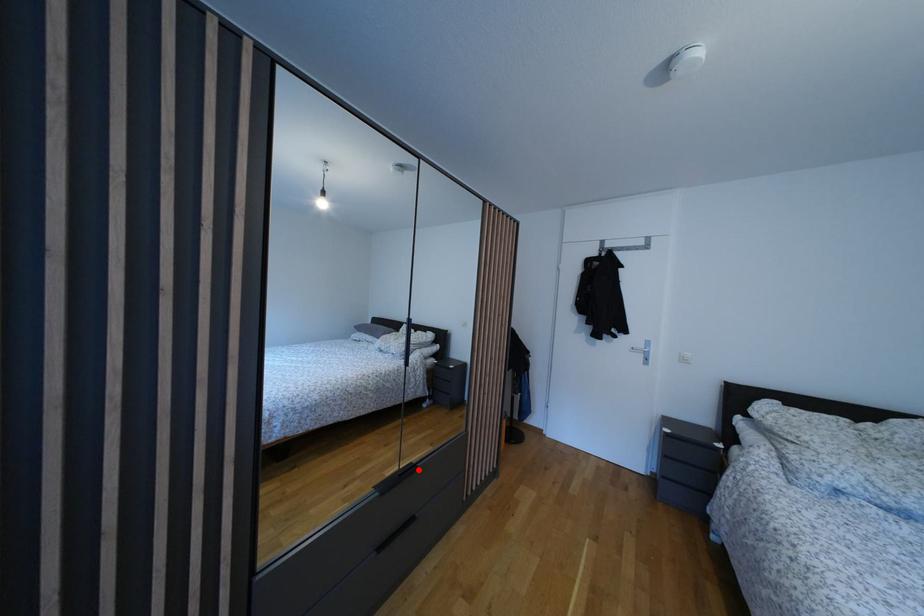
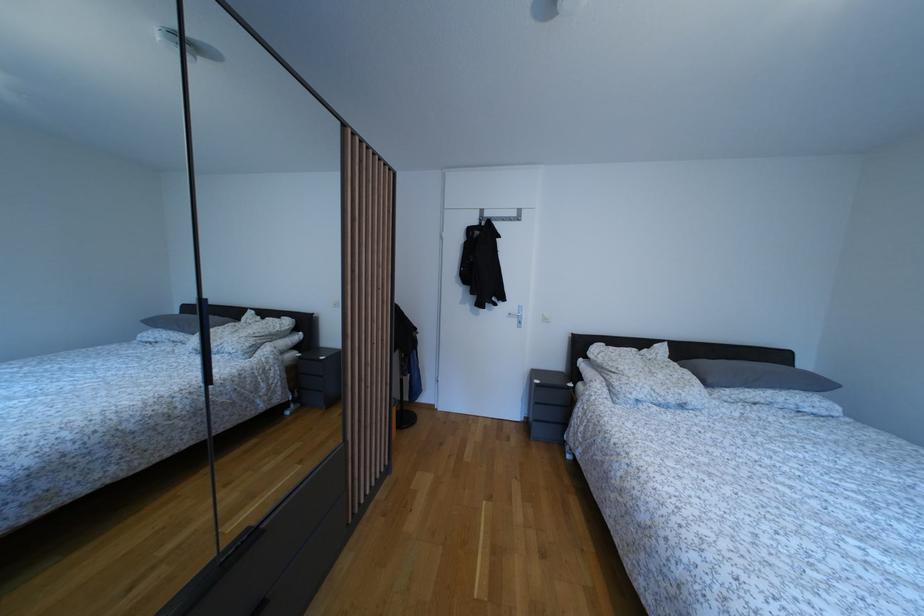
Question: I am providing you with two images of the same scene from different viewpoints. In image1, a red point is highlighted. Considering the same 3D point in image2, which of the following is correct?

Choices:
 (A) It is closer
 (B) It is farther

Answer: (B)